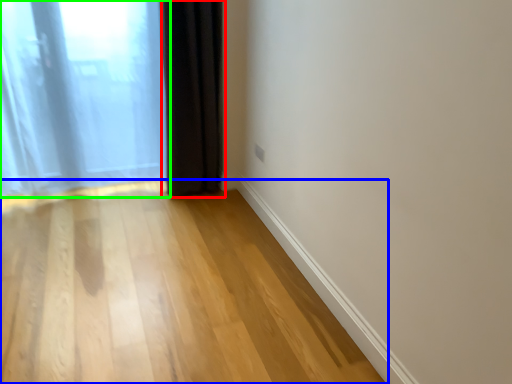
Question: Based on their relative distances, which object is farther from curtain (highlighted by a red box)? Choose from corridor (highlighted by a blue box) and curtain (highlighted by a green box).

Choices:
 (A) corridor
 (B) curtain

Answer: (A)